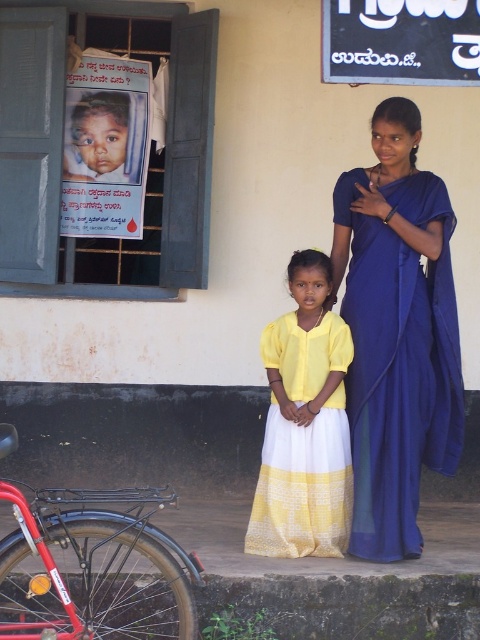
You are a fashion designer who wants to place a new accessory exactly at the position of the yellow cotton dress at center in the image. What coordinates should you use for the accessory placement?

The coordinates for the yellow cotton dress at center are at point [304,424], so you should place the accessory at those coordinates.